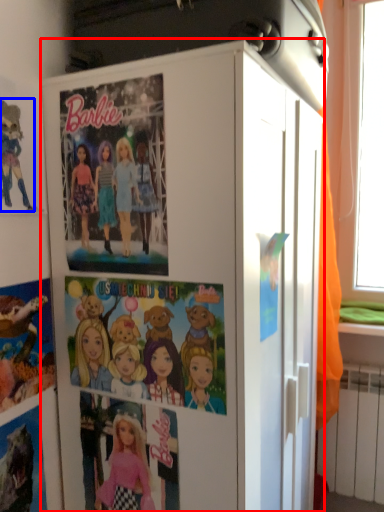
Question: Among these objects, which one is nearest to the camera, cabinetry (highlighted by a red box) or cartoon (highlighted by a blue box)?

Choices:
 (A) cabinetry
 (B) cartoon

Answer: (A)